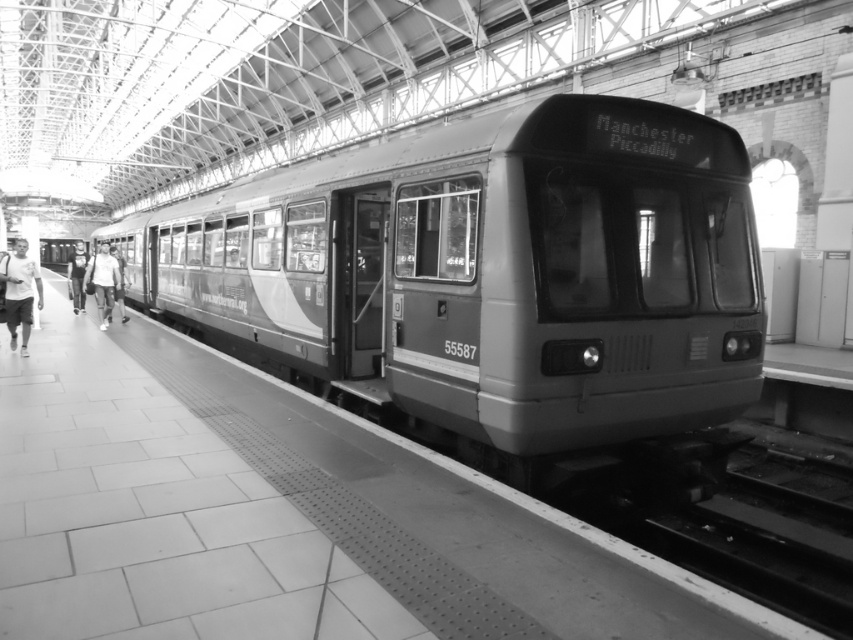
Question: Which is nearer to the light gray fabric jacket at left?

Choices:
 (A) denim jacket at center
 (B) metallic gray train at center
 (C) light gray shirt at left

Answer: (C)

Question: Can you confirm if light gray shirt at left is positioned above light gray fabric jacket at left?

Choices:
 (A) no
 (B) yes

Answer: (A)

Question: Does metallic gray train at center come behind light gray fabric jacket at left?

Choices:
 (A) yes
 (B) no

Answer: (B)

Question: Does light gray fabric jacket at left appear under denim jacket at center?

Choices:
 (A) yes
 (B) no

Answer: (A)

Question: Estimate the real-world distances between objects in this image. Which object is farther from the light gray shirt at left?

Choices:
 (A) metallic gray train at center
 (B) denim jacket at center
 (C) light gray fabric jacket at left

Answer: (B)

Question: Which point is farther to the camera?

Choices:
 (A) light gray fabric jacket at left
 (B) denim jacket at center
 (C) light gray shirt at left

Answer: (B)